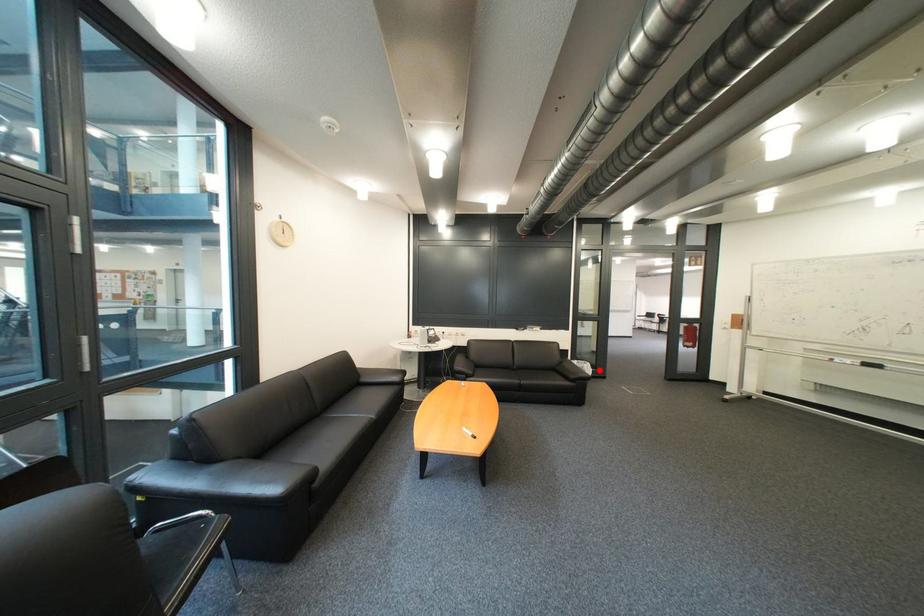
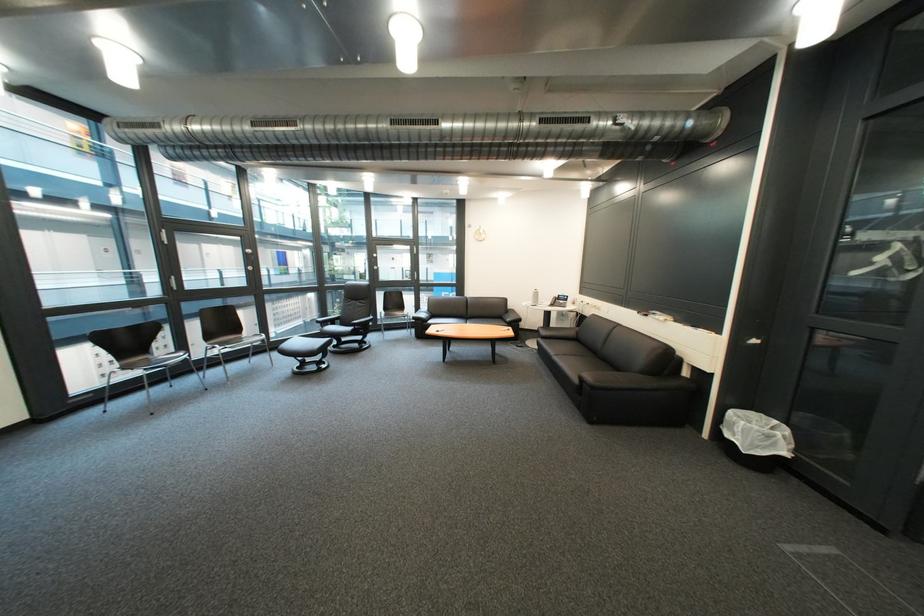
Locate, in the second image, the point that corresponds to the highlighted location in the first image.

(751, 431)